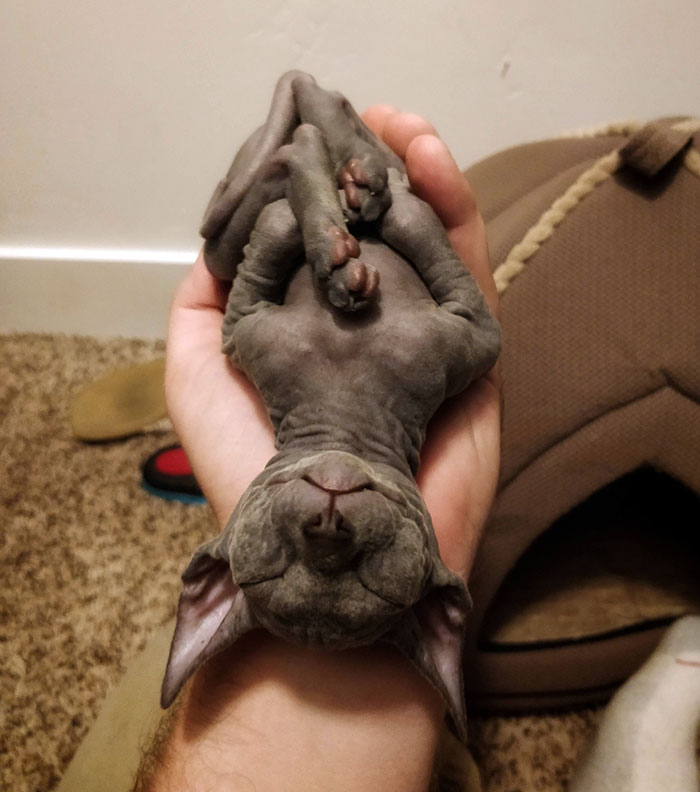
Where is `rug`? The height and width of the screenshot is (792, 700). rug is located at coordinates (49, 452).